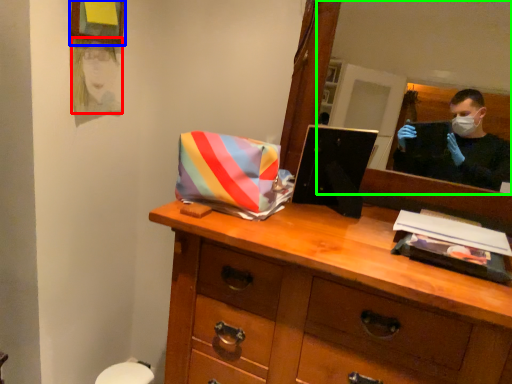
Question: Based on their relative distances, which object is farther from person (highlighted by a red box)? Choose from picture frame (highlighted by a blue box) and mirror (highlighted by a green box).

Choices:
 (A) picture frame
 (B) mirror

Answer: (B)